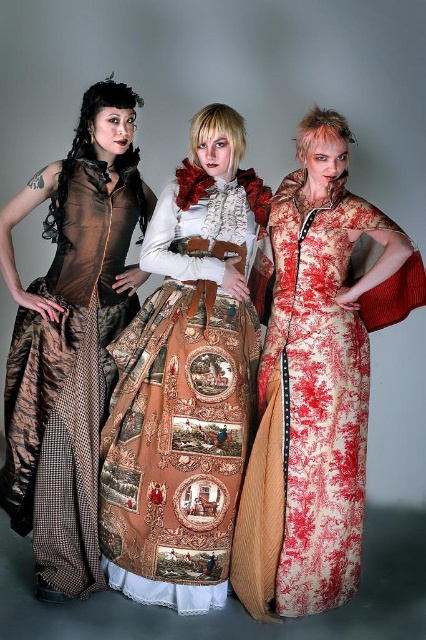
You are a photographer setting up a shoot with the three individuals in the image. You want to ensure that the matte brown dress at left is fully visible in the photo. Should you adjust the position of the red toile dress at center?

The red toile dress at center is in front of the matte brown dress at left, so yes, you should move the red toile dress at center to allow the matte brown dress at left to be fully visible.

You are a photographer setting up a shoot with three people wearing different costumes. You notice the brown textured skirt at center and the red toile dress at center. Which costume is closer to you?

The brown textured skirt at center is closer to you than the red toile dress at center.